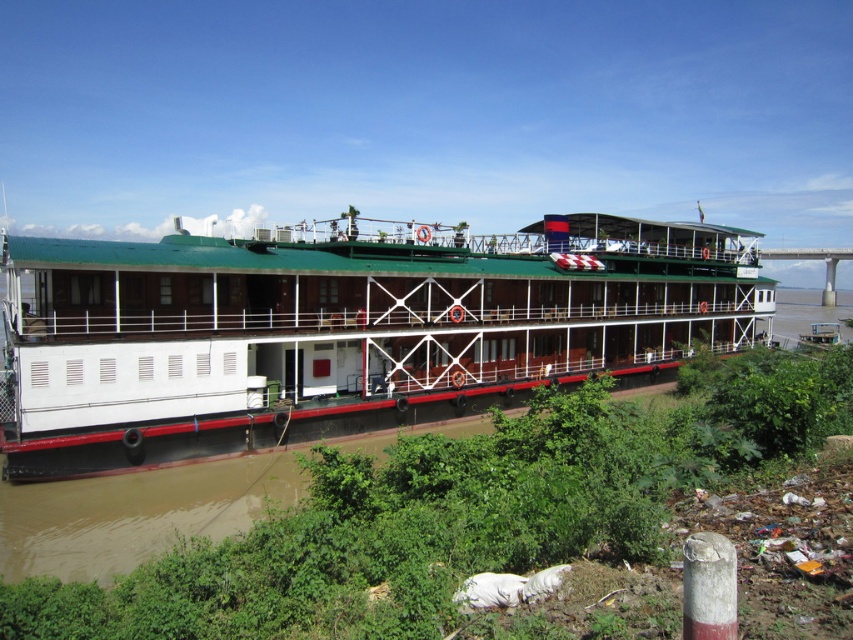
Question: Which point is closer to the camera?

Choices:
 (A) (161, 412)
 (B) (534, 509)

Answer: (B)

Question: Which object appears closest to the camera in this image?

Choices:
 (A) green leafy vegetation at lower center
 (B) white matte boat at center

Answer: (A)

Question: Which object appears farthest from the camera in this image?

Choices:
 (A) white matte boat at center
 (B) green leafy vegetation at lower center

Answer: (A)

Question: Does white matte boat at center come in front of green leafy vegetation at lower center?

Choices:
 (A) yes
 (B) no

Answer: (B)

Question: Is white matte boat at center above green leafy vegetation at lower center?

Choices:
 (A) yes
 (B) no

Answer: (A)

Question: Is white matte boat at center to the right of green leafy vegetation at lower center from the viewer's perspective?

Choices:
 (A) yes
 (B) no

Answer: (B)